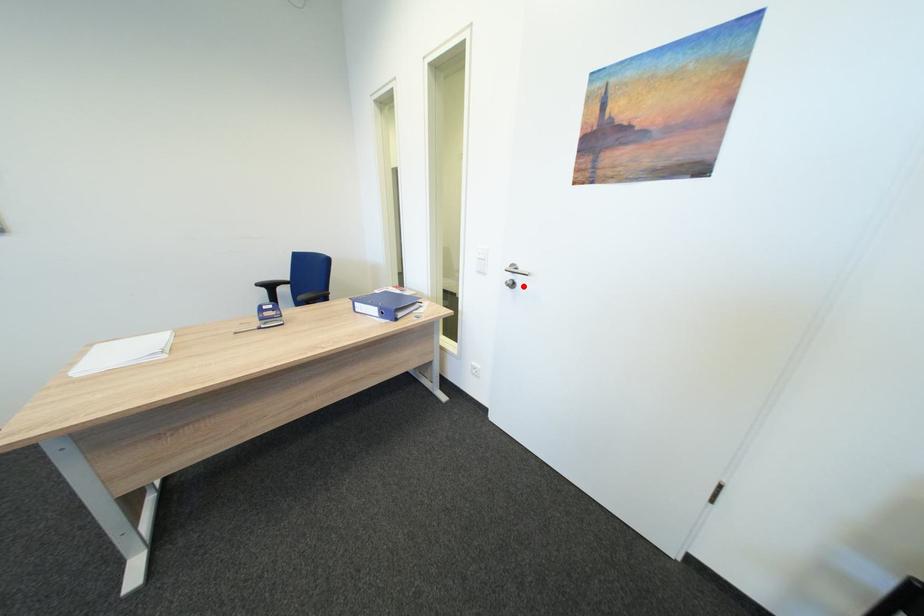
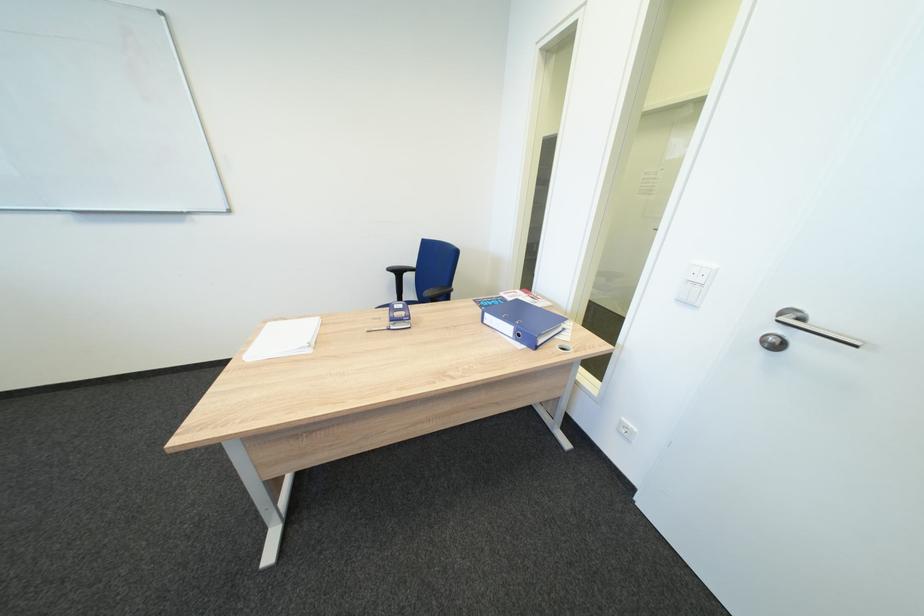
The point at the highlighted location is marked in the first image. Where is the corresponding point in the second image?

(784, 346)